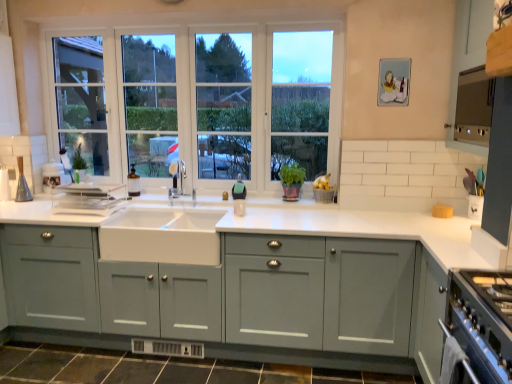
Where is `vacant location behind satin nickel faucet at center`? The width and height of the screenshot is (512, 384). vacant location behind satin nickel faucet at center is located at coordinates point(174,198).